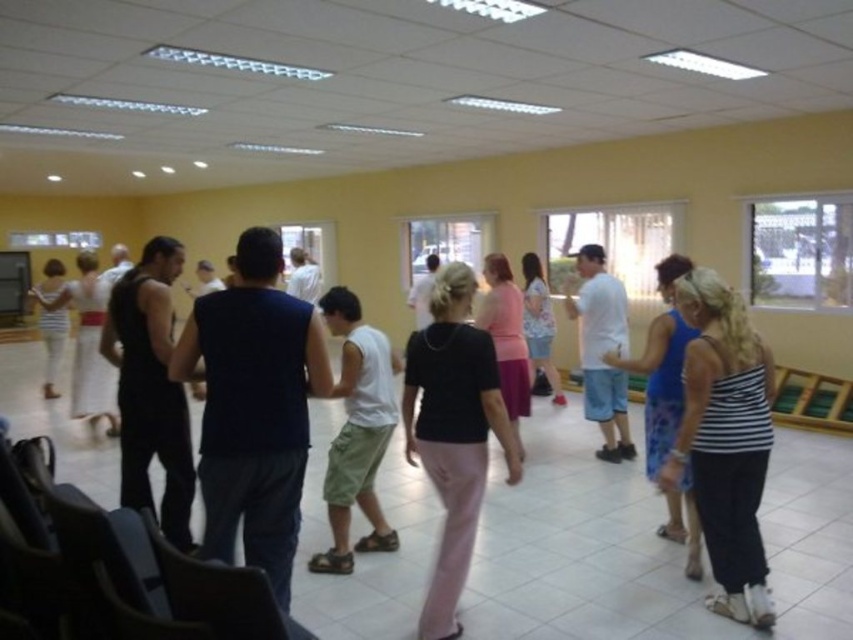
You are a photographer positioned at the camera. You want to capture a closeup shot of the white cotton tank top at center. Can you move closer to get a better shot without exceeding the room boundaries?

The distance between you and the white cotton tank top at center is 8.94 feet. Since you can move closer within the room, you can reduce this distance to achieve a better closeup shot as long as you stay within the room limits.

You are standing in the room and want to hand a note to both the person wearing the white cotton shirt at center and the person wearing the light pink fabric dress at center. Which one should you approach first to ensure you can reach them without moving past the other?

You should approach the white cotton shirt at center first because it is closer to you than the light pink fabric dress at center.